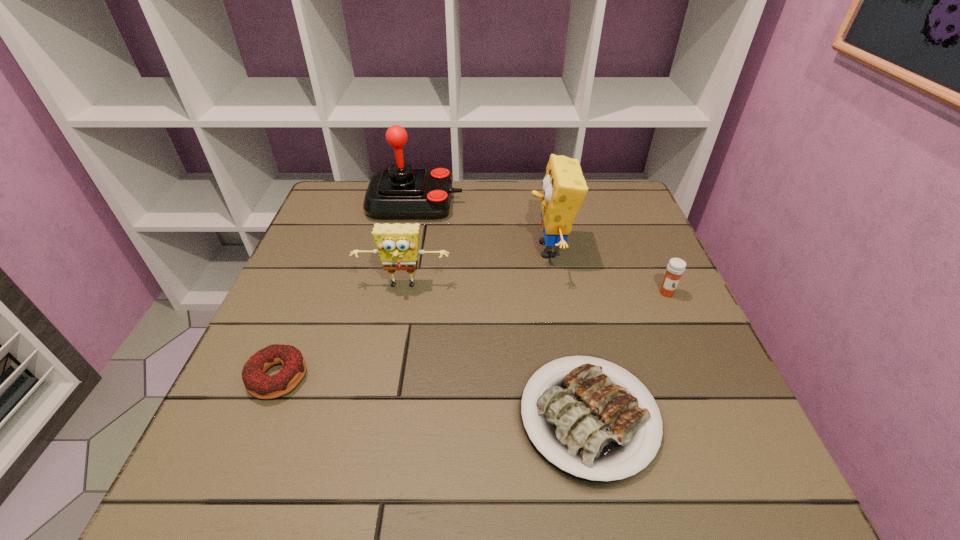
The image size is (960, 540). I want to click on joystick present at the left edge, so click(402, 192).

This screenshot has height=540, width=960. In order to click on doughnut that is at the left edge in this screenshot , I will do `click(259, 384)`.

I want to click on medicine present at the right edge, so click(x=676, y=267).

Identify the location of plate located in the right edge section of the desktop. (596, 427).

This screenshot has width=960, height=540. I want to click on object positioned at the far left corner, so click(402, 192).

Locate an element on the screen. This screenshot has width=960, height=540. object at the near right corner is located at coordinates (596, 427).

Find the location of a particular element. free region at the far edge is located at coordinates (481, 206).

In the image, there is a desktop. At what (x,y) coordinates should I click in order to perform the action: click on blank space at the left edge. Please return your answer as a coordinate pair (x, y). Looking at the image, I should click on (336, 231).

Find the location of a particular element. vacant space at the right edge of the desktop is located at coordinates (646, 302).

You are a GUI agent. You are given a task and a screenshot of the screen. Output one action in this format:
    pyautogui.click(x=<x>, y=<y>)
    Task: Click on the free spot at the far right corner of the desktop
    
    Given the screenshot: What is the action you would take?
    pyautogui.click(x=596, y=207)